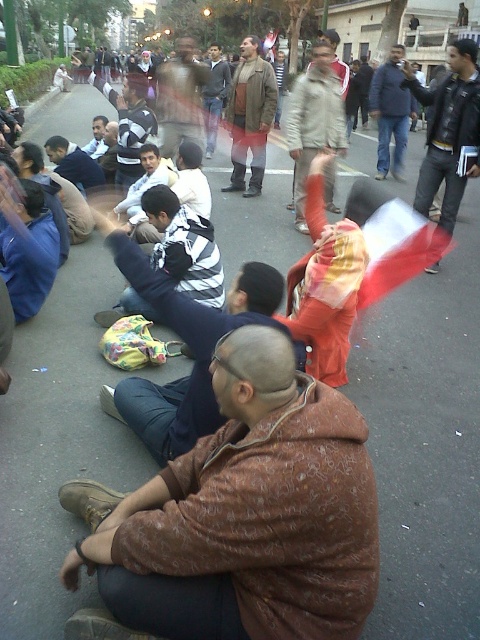
You are a photographer trying to capture a candid shot of the striped fabric shirt at center and the blue jeans at center. Which object is located to the left of the other?

The striped fabric shirt at center is positioned on the left side of blue jeans at center.